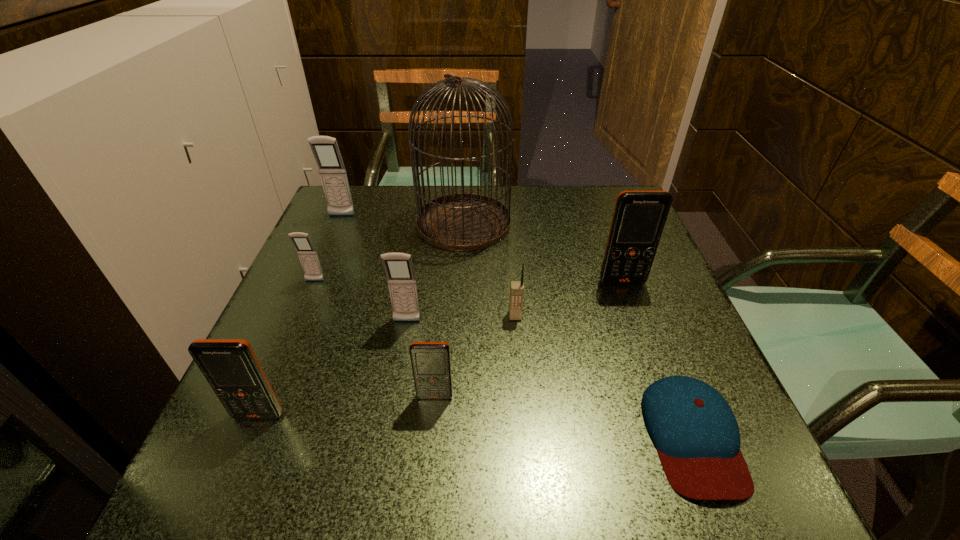
Select which orange cellular telephone appears as the second closest to the rightmost orange cellular telephone. Please provide its 2D coordinates. Your answer should be formatted as a tuple, i.e. [(x, y)], where the tuple contains the x and y coordinates of a point satisfying the conditions above.

[(230, 366)]

Identify which orange cellular telephone is located as the nearest to the leftmost orange cellular telephone. Please provide its 2D coordinates. Your answer should be formatted as a tuple, i.e. [(x, y)], where the tuple contains the x and y coordinates of a point satisfying the conditions above.

[(431, 364)]

At what (x,y) coordinates should I click in order to perform the action: click on vacant space that satisfies the following two spatial constraints: 1. on the front-facing side of the birdcage; 2. on the left side of the farthest gray cellular telephone. Please return your answer as a coordinate pair (x, y). The height and width of the screenshot is (540, 960). Looking at the image, I should click on (339, 223).